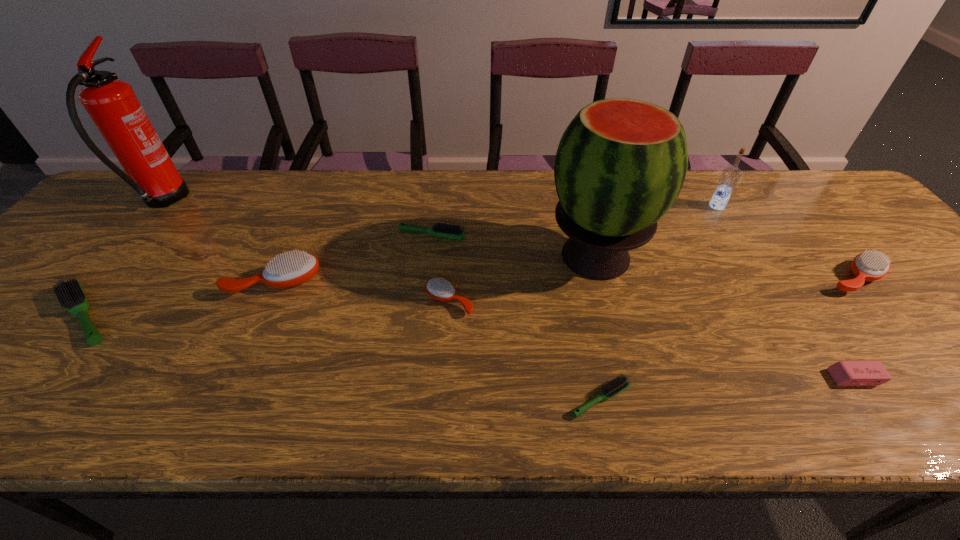
At what (x,y) coordinates should I click in order to perform the action: click on the smallest orange hairbrush. Please return your answer as a coordinate pair (x, y). Image resolution: width=960 pixels, height=540 pixels. Looking at the image, I should click on (440, 289).

In order to click on the second biggest light hairbrush in this screenshot , I will do point(444,230).

Where is `the second light hairbrush from left to right`? The image size is (960, 540). the second light hairbrush from left to right is located at coordinates (444, 230).

This screenshot has height=540, width=960. What are the coordinates of `eraser` in the screenshot? It's located at (844, 373).

Locate an element on the screen. This screenshot has height=540, width=960. the smallest light hairbrush is located at coordinates (621, 383).

The height and width of the screenshot is (540, 960). Find the location of `the shortest object`. the shortest object is located at coordinates (621, 383).

This screenshot has width=960, height=540. Find the location of `free space located 0.120m at the nozzle of the red fire extinguisher`. free space located 0.120m at the nozzle of the red fire extinguisher is located at coordinates (225, 202).

Locate an element on the screen. Image resolution: width=960 pixels, height=540 pixels. vacant area situated 0.320m on the left of the watermelon is located at coordinates (417, 257).

This screenshot has width=960, height=540. In order to click on vacant space located on the left of the eighth shortest object in this screenshot , I will do `click(608, 206)`.

You are a GUI agent. You are given a task and a screenshot of the screen. Output one action in this format:
    pyautogui.click(x=<x>, y=<y>)
    Task: Click on the free space located on the right of the tallest hairbrush
    Image resolution: width=960 pixels, height=540 pixels.
    Given the screenshot: What is the action you would take?
    pyautogui.click(x=441, y=282)